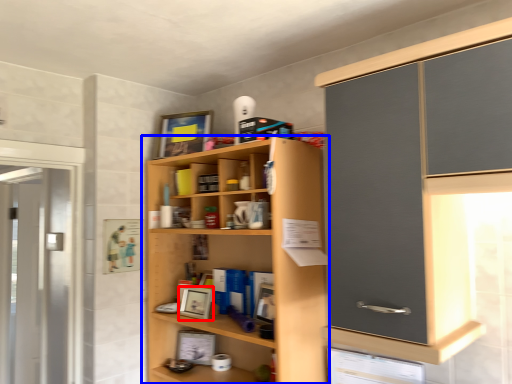
Question: Which object is further to the camera taking this photo, picture frame (highlighted by a red box) or cupboard (highlighted by a blue box)?

Choices:
 (A) picture frame
 (B) cupboard

Answer: (A)